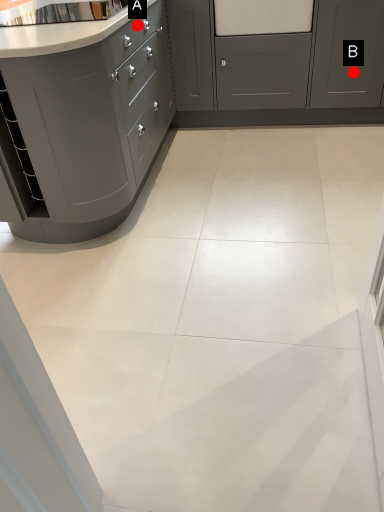
Question: Two points are circled on the image, labeled by A and B beside each circle. Among these points, which one is farthest from the camera?

Choices:
 (A) A is further
 (B) B is further

Answer: (B)